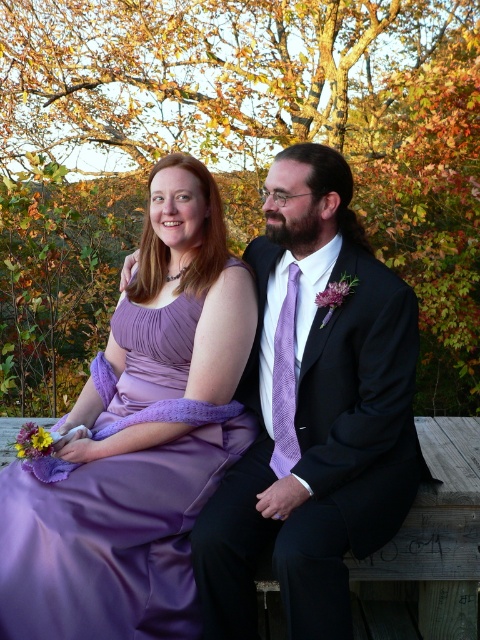
You are standing in front of the couple in the image. There are two points marked in the scene. One is at coordinate point [66,573] and the other is at point [294,328]. Which point is closer to you?

Point [66,573] is closer to the viewer than point [294,328].

You are a photographer setting up for an outdoor wedding photo session. You have two main subjects wearing the lavender satin dress at center and the matte black suit at center. Based on the scene description, which clothing item takes up more visual space in the image?

The lavender satin dress at center is bigger than the matte black suit at center, so it takes up more visual space in the image.

You are a photographer setting up for a portrait of the couple. You need to position a spotlight so it illuminates the matte black suit at center and the lavender textured tie at center. Which object should you aim the spotlight lower to reach first?

The matte black suit at center is below the lavender textured tie at center, so you should aim the spotlight lower to reach the matte black suit at center first.